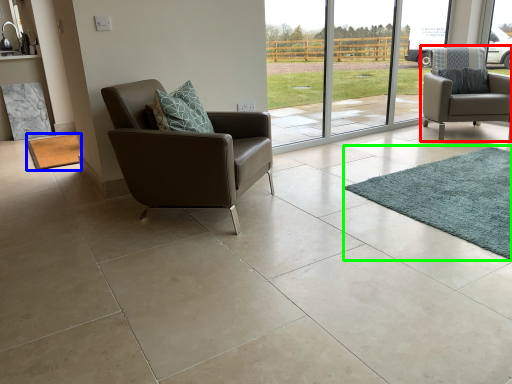
Question: Which object is the farthest from chair (highlighted by a red box)? Choose among these: mat (highlighted by a blue box) or mat (highlighted by a green box).

Choices:
 (A) mat
 (B) mat

Answer: (A)